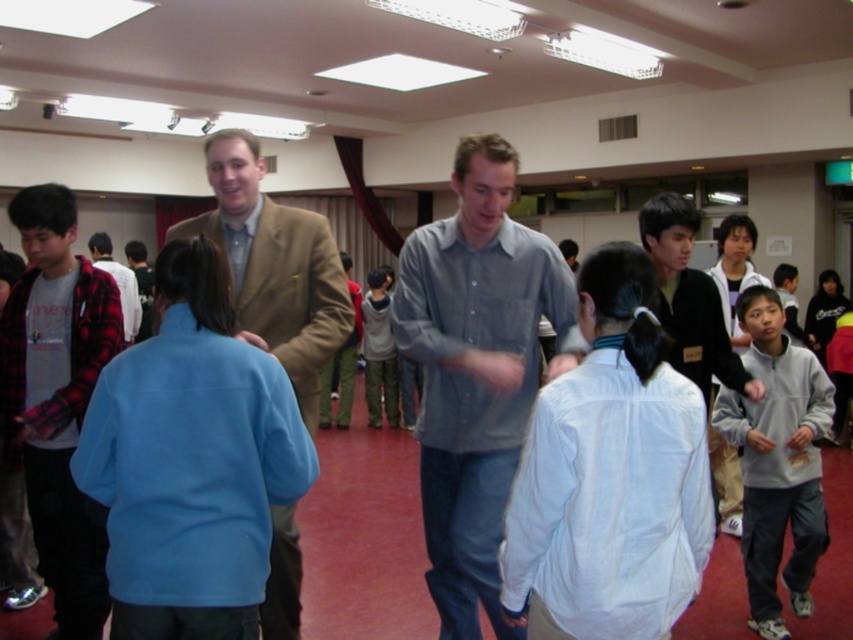
You are standing in the center of the hall and want to walk to both the point at coordinates (x=799, y=435) and the point at coordinates (x=100, y=241). Which point will require you to walk a shorter distance?

Point (x=799, y=435) is closer to the camera than point (x=100, y=241), so you will need to walk a shorter distance to reach point (x=799, y=435).

You are organizing a photo shoot and need to ensure that all participants are visible in the frame. Given the current setup, which of the two individuals, the gray cotton shirt at center or the light gray sweater at center, might be more challenging to fully capture in a single photo due to their size?

The gray cotton shirt at center is bigger than the light gray sweater at center, so it might be more challenging to fully capture the gray cotton shirt at center in a single photo due to its larger size.